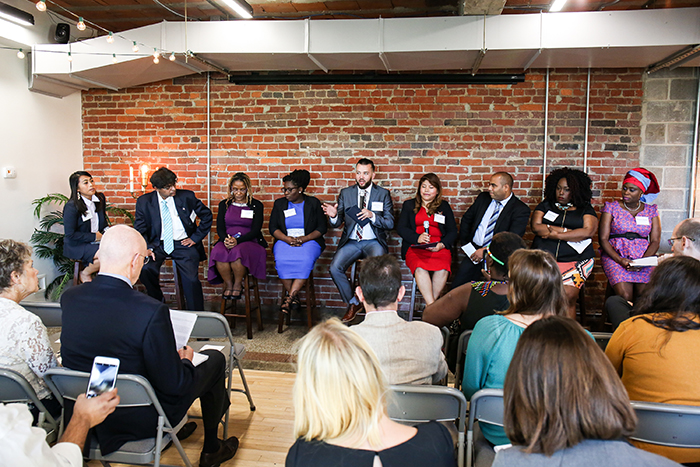
Image resolution: width=700 pixels, height=467 pixels. In order to click on people sitting on stools in this screenshot , I will do `click(92, 218)`, `click(171, 221)`, `click(232, 222)`, `click(290, 239)`, `click(364, 225)`, `click(426, 235)`, `click(504, 222)`, `click(552, 223)`, `click(634, 224)`.